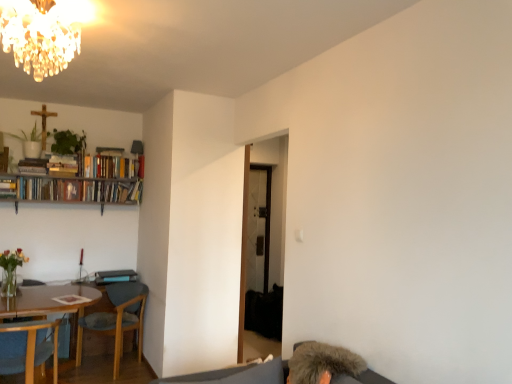
Question: Can you confirm if crystal glass chandelier at upper left is wider than fuzzy gray hair at lower right?

Choices:
 (A) no
 (B) yes

Answer: (B)

Question: Is crystal glass chandelier at upper left smaller than fuzzy gray hair at lower right?

Choices:
 (A) no
 (B) yes

Answer: (A)

Question: Is crystal glass chandelier at upper left closer to the viewer compared to fuzzy gray hair at lower right?

Choices:
 (A) no
 (B) yes

Answer: (B)

Question: Is crystal glass chandelier at upper left looking in the opposite direction of fuzzy gray hair at lower right?

Choices:
 (A) yes
 (B) no

Answer: (B)

Question: Could you tell me if crystal glass chandelier at upper left is facing fuzzy gray hair at lower right?

Choices:
 (A) yes
 (B) no

Answer: (B)

Question: Considering the relative positions of crystal glass chandelier at upper left and fuzzy gray hair at lower right in the image provided, is crystal glass chandelier at upper left to the right of fuzzy gray hair at lower right from the viewer's perspective?

Choices:
 (A) no
 (B) yes

Answer: (A)

Question: From a real-world perspective, is fuzzy gray hair at lower right positioned over hardcover books at upper left, the 2th book in the left-to-right sequence, based on gravity?

Choices:
 (A) yes
 (B) no

Answer: (B)

Question: From the image's perspective, is fuzzy gray hair at lower right located above hardcover books at upper left, the 2th book in the left-to-right sequence?

Choices:
 (A) yes
 (B) no

Answer: (B)

Question: From a real-world perspective, is fuzzy gray hair at lower right physically below hardcover books at upper left, placed as the first book when sorted from right to left?

Choices:
 (A) no
 (B) yes

Answer: (B)

Question: Could you tell me if fuzzy gray hair at lower right is turned towards hardcover books at upper left, the 2th book in the left-to-right sequence?

Choices:
 (A) no
 (B) yes

Answer: (A)

Question: Is fuzzy gray hair at lower right with hardcover books at upper left, the 2th book in the left-to-right sequence?

Choices:
 (A) no
 (B) yes

Answer: (A)

Question: Is fuzzy gray hair at lower right smaller than hardcover books at upper left, placed as the first book when sorted from right to left?

Choices:
 (A) no
 (B) yes

Answer: (B)

Question: Is green leafy plant at upper left, the 1th plant positioned from the right, taller than wooden chair at lower left, the 1th chair viewed from the front?

Choices:
 (A) no
 (B) yes

Answer: (A)